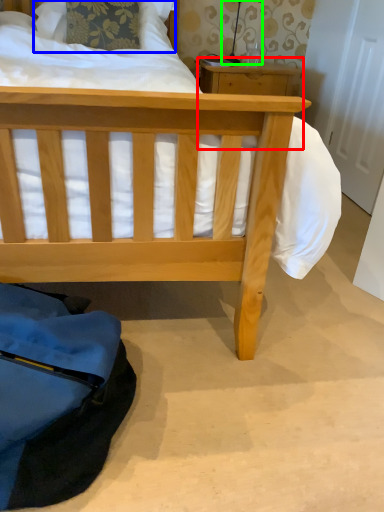
Question: Which object is positioned closest to table (highlighted by a red box)? Select from pillow (highlighted by a blue box) and table lamp (highlighted by a green box).

Choices:
 (A) pillow
 (B) table lamp

Answer: (B)